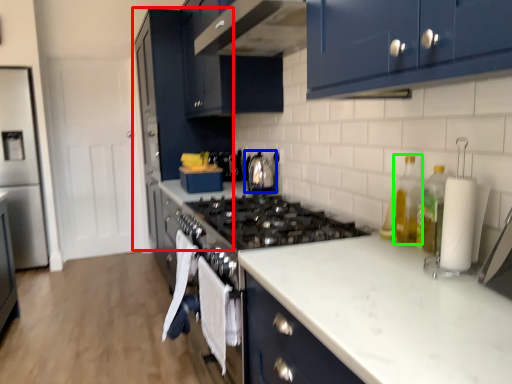
Question: Considering the real-world distances, which object is farthest from cabinetry (highlighted by a red box)? kitchen appliance (highlighted by a blue box) or bottle (highlighted by a green box)?

Choices:
 (A) kitchen appliance
 (B) bottle

Answer: (B)